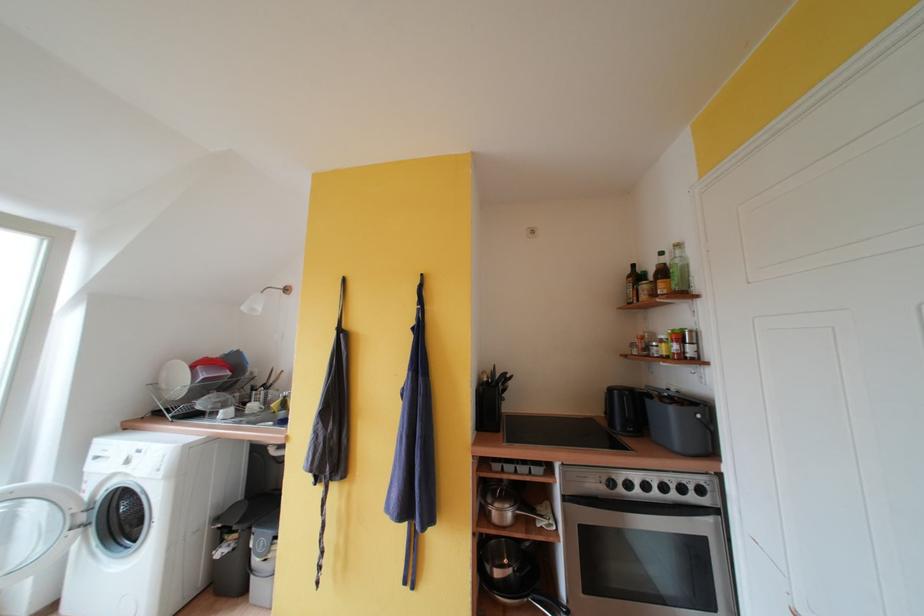
Image resolution: width=924 pixels, height=616 pixels. What are the coordinates of `oven door handle` in the screenshot? It's located at (641, 507).